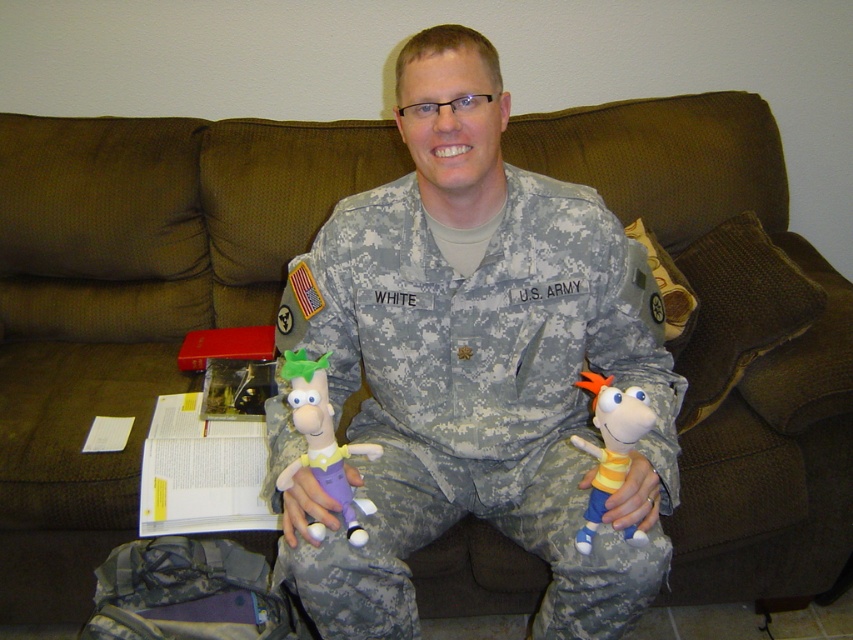
Question: Does camouflage fabric us army uniform at center appear on the left side of plush green hat at center?

Choices:
 (A) no
 (B) yes

Answer: (A)

Question: Which object is closer to the camera taking this photo?

Choices:
 (A) camouflage fabric us army uniform at center
 (B) yellow striped fabric doll at lower right
 (C) plush green hat at center

Answer: (B)

Question: Is plush green hat at center to the left of yellow striped fabric doll at lower right from the viewer's perspective?

Choices:
 (A) no
 (B) yes

Answer: (B)

Question: Is plush green hat at center behind yellow striped fabric doll at lower right?

Choices:
 (A) no
 (B) yes

Answer: (B)

Question: Estimate the real-world distances between objects in this image. Which object is farther from the plush green hat at center?

Choices:
 (A) yellow striped fabric doll at lower right
 (B) camouflage fabric us army uniform at center

Answer: (A)

Question: Which point appears closest to the camera in this image?

Choices:
 (A) (383, 604)
 (B) (358, 540)
 (C) (625, 531)

Answer: (B)